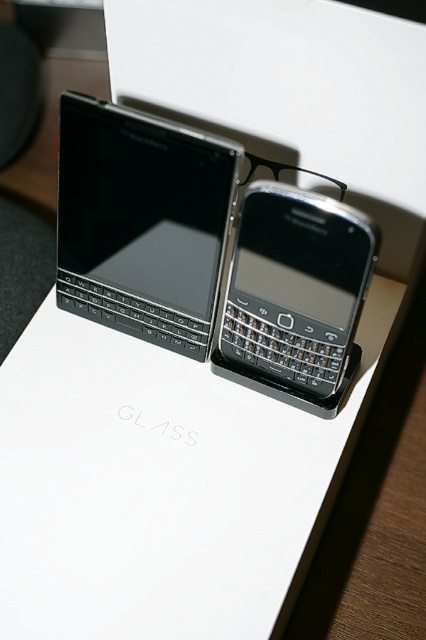
Question: Which point appears farthest from the camera in this image?

Choices:
 (A) (270, 376)
 (B) (155, 288)

Answer: (B)

Question: Can you confirm if matte black keyboard at upper left is positioned to the right of black matte smartphone at center?

Choices:
 (A) yes
 (B) no

Answer: (B)

Question: From the image, what is the correct spatial relationship of matte black keyboard at upper left in relation to black matte smartphone at center?

Choices:
 (A) below
 (B) above

Answer: (B)

Question: Is matte black keyboard at upper left closer to camera compared to black matte smartphone at center?

Choices:
 (A) yes
 (B) no

Answer: (B)

Question: Which point appears closest to the camera in this image?

Choices:
 (A) (377, 228)
 (B) (118, 204)

Answer: (A)